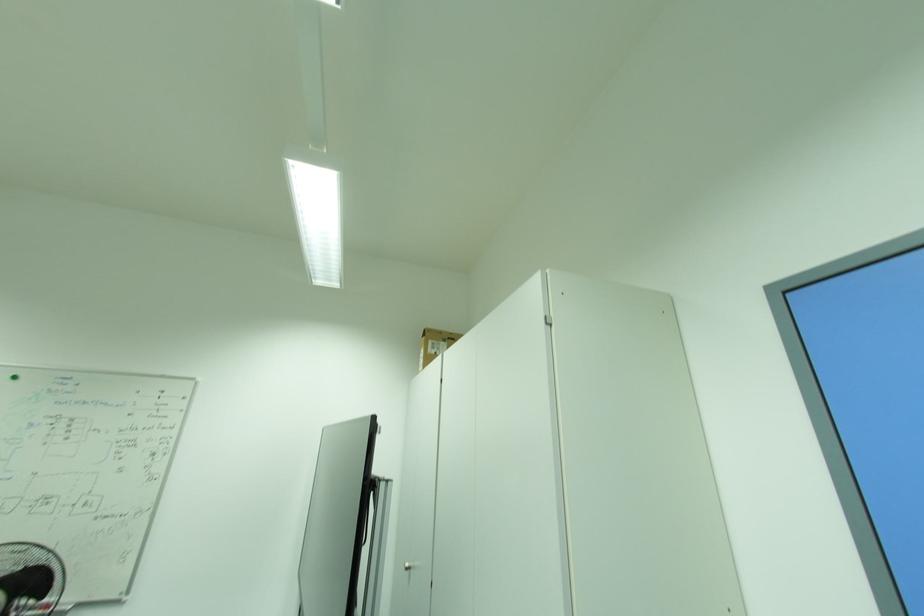
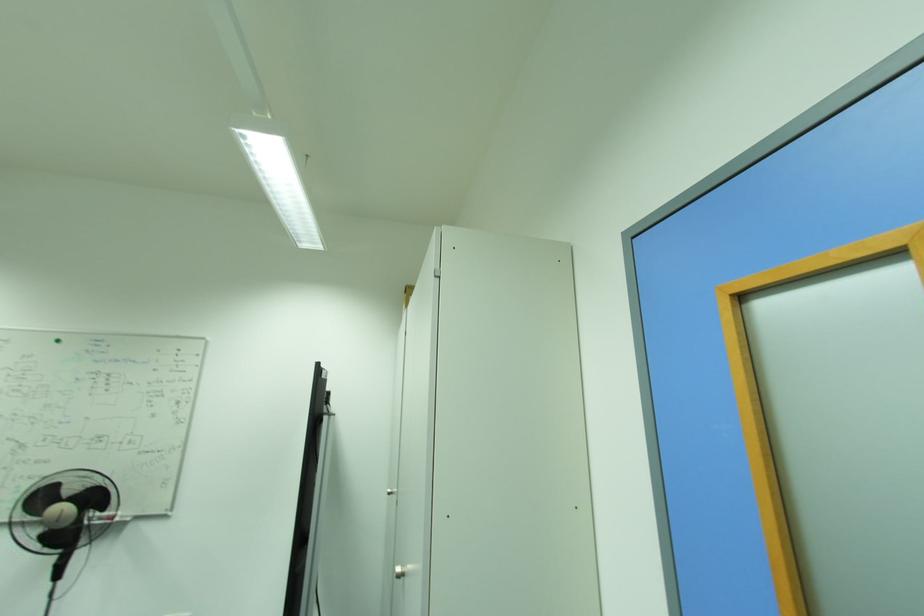
Question: The images are taken continuously from a first-person perspective. In which direction are you moving?

Choices:
 (A) Left
 (B) Right
 (C) Forward
 (D) Backward

Answer: (B)